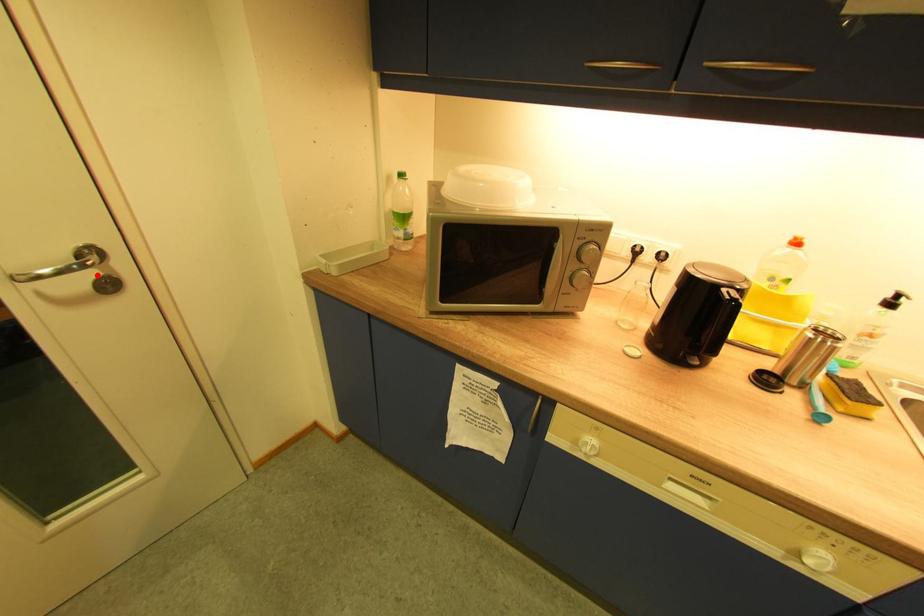
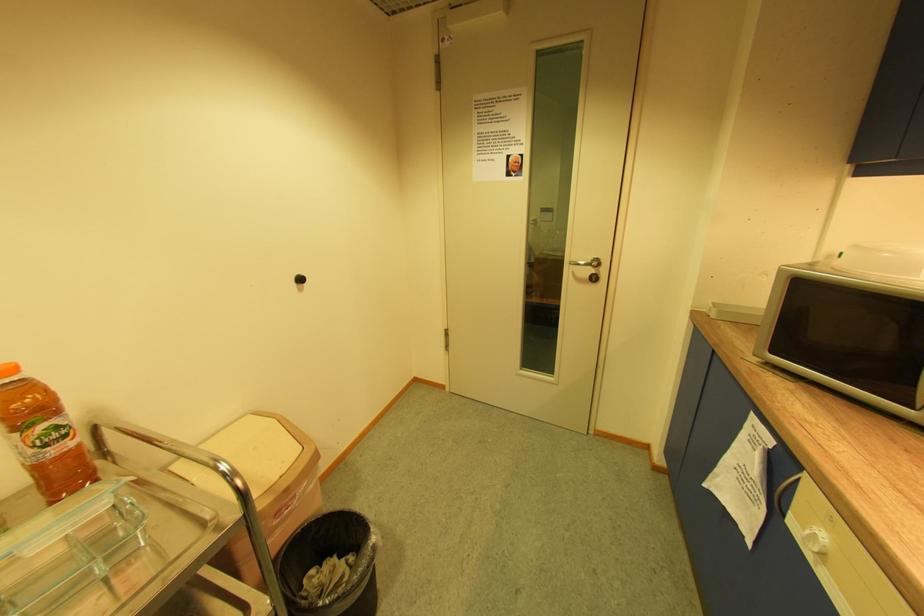
Find the pixel in the second image that matches the highlighted location in the first image.

(598, 272)